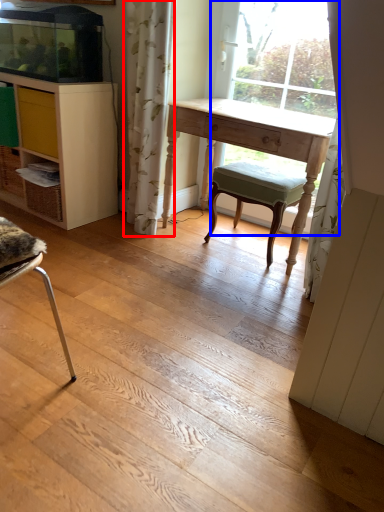
Question: Among these objects, which one is nearest to the camera, curtain (highlighted by a red box) or bay window (highlighted by a blue box)?

Choices:
 (A) curtain
 (B) bay window

Answer: (A)